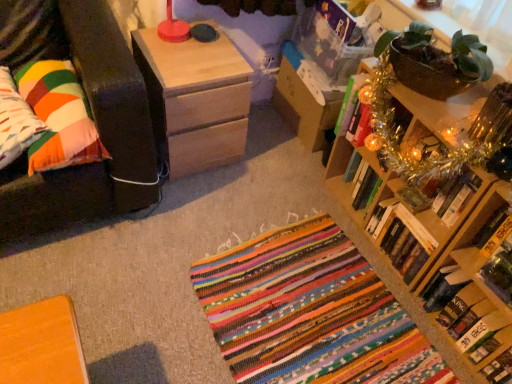
This screenshot has height=384, width=512. Find the location of `vacant space behind multicolored woven rug at center`. vacant space behind multicolored woven rug at center is located at coordinates (266, 190).